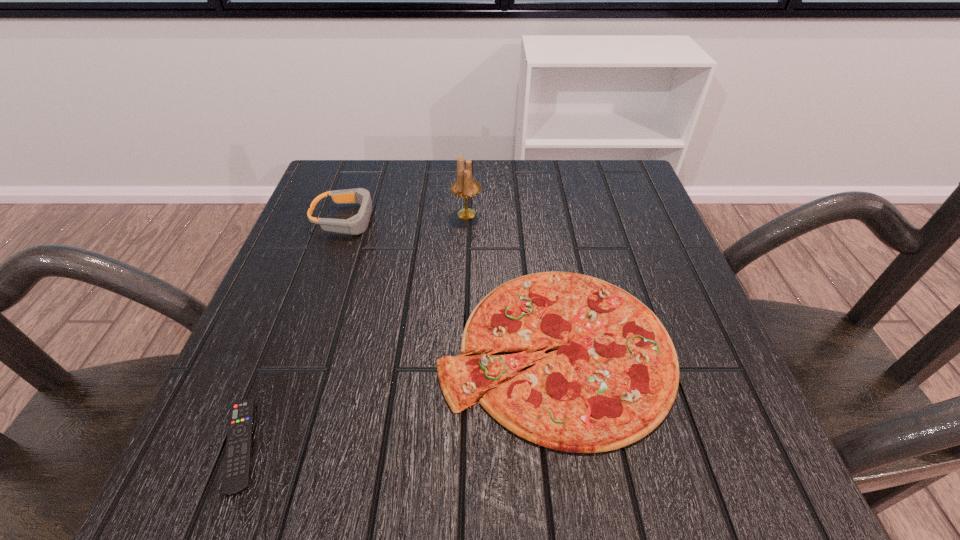
At what (x,y) coordinates should I click in order to perform the action: click on free space that satisfies the following two spatial constraints: 1. on the front and back of the second tallest object; 2. on the front side of the shortest object. Please return your answer as a coordinate pair (x, y). The image size is (960, 540). Looking at the image, I should click on coord(269,444).

Locate an element on the screen. This screenshot has width=960, height=540. free space that satisfies the following two spatial constraints: 1. on the back side of the third tallest object; 2. on the right side of the shortest object is located at coordinates (277, 349).

I want to click on free space that satisfies the following two spatial constraints: 1. on the front side of the candle holder; 2. on the front and back of the goggles, so click(467, 219).